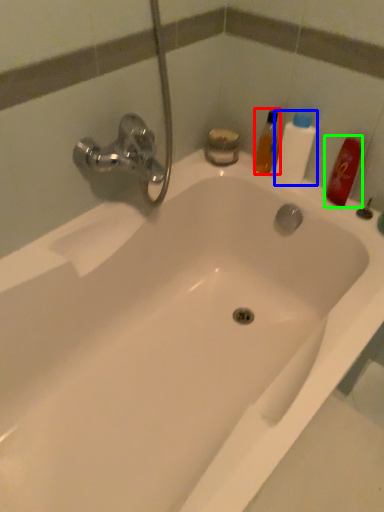
Question: Considering the real-world distances, which object is closest to mouthwash (highlighted by a red box)? cleaning product (highlighted by a blue box) or mouthwash (highlighted by a green box).

Choices:
 (A) cleaning product
 (B) mouthwash

Answer: (A)